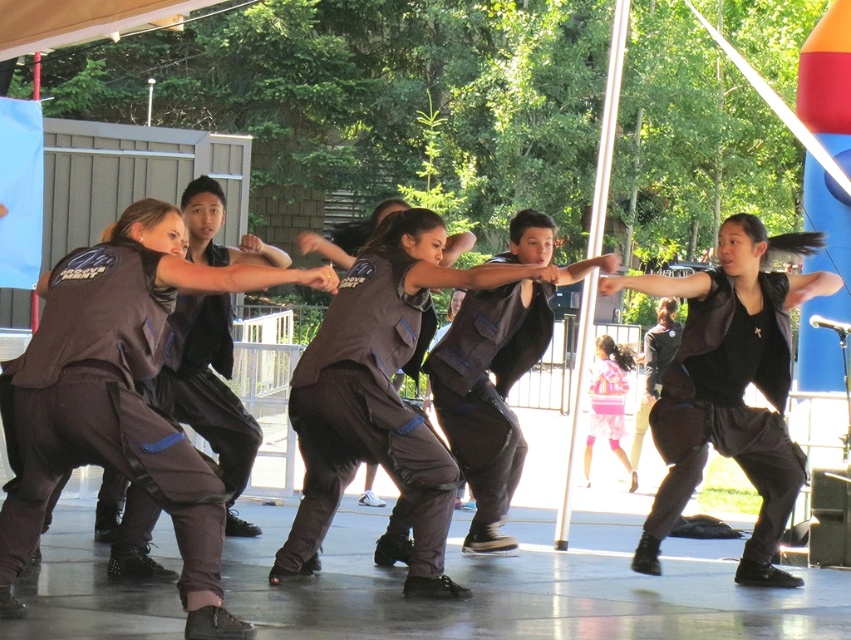
Question: Is matte black vest at center wider than black matte vest at center?

Choices:
 (A) yes
 (B) no

Answer: (A)

Question: Which point is closer to the camera?

Choices:
 (A) matte black vest at center
 (B) black matte vest at center

Answer: (A)

Question: Does matte black vest at center appear over black matte vest at center?

Choices:
 (A) no
 (B) yes

Answer: (B)

Question: Does matte black vest at center have a smaller size compared to black matte vest at center?

Choices:
 (A) yes
 (B) no

Answer: (B)